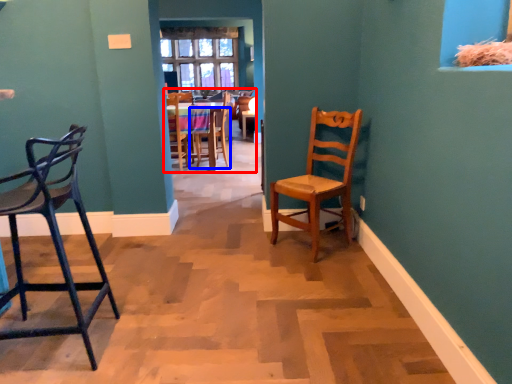
Question: Among these objects, which one is farthest to the camera, chair (highlighted by a red box) or chair (highlighted by a blue box)?

Choices:
 (A) chair
 (B) chair

Answer: (B)